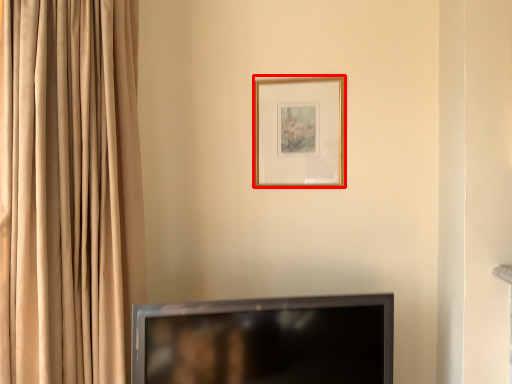
Question: From the image, what is the correct spatial relationship of picture frame (annotated by the red box) in relation to television?

Choices:
 (A) right
 (B) left

Answer: (A)